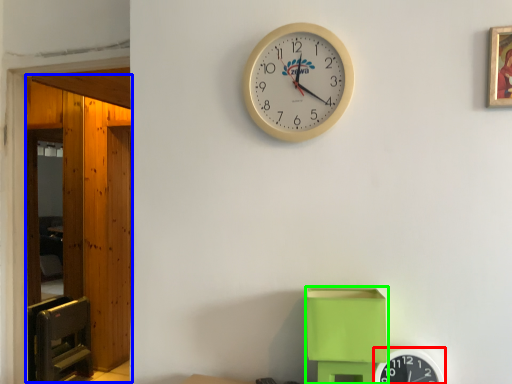
Question: Estimate the real-world distances between objects in this image. Which object is closer to wall clock (highlighted by a red box), glass door (highlighted by a blue box) or toy (highlighted by a green box)?

Choices:
 (A) glass door
 (B) toy

Answer: (B)